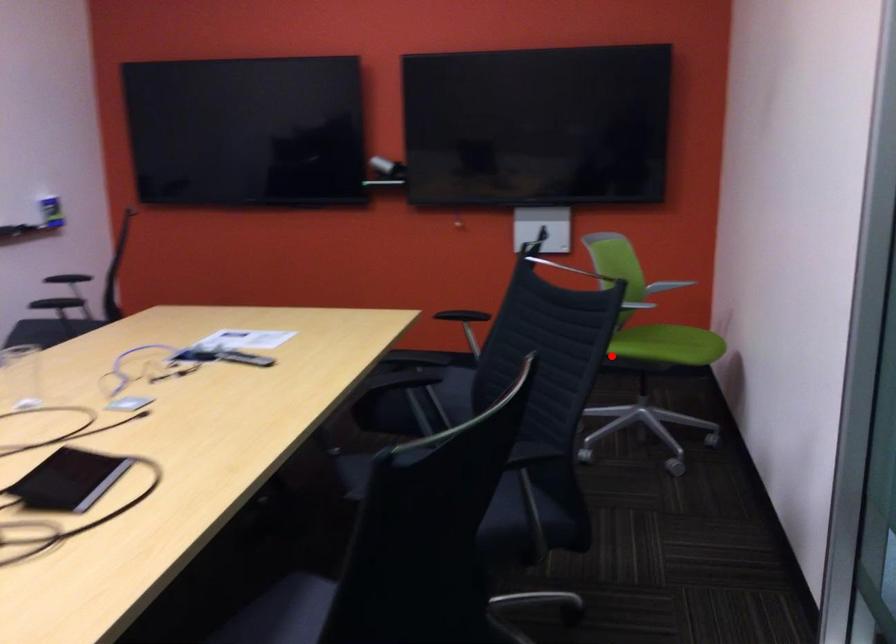
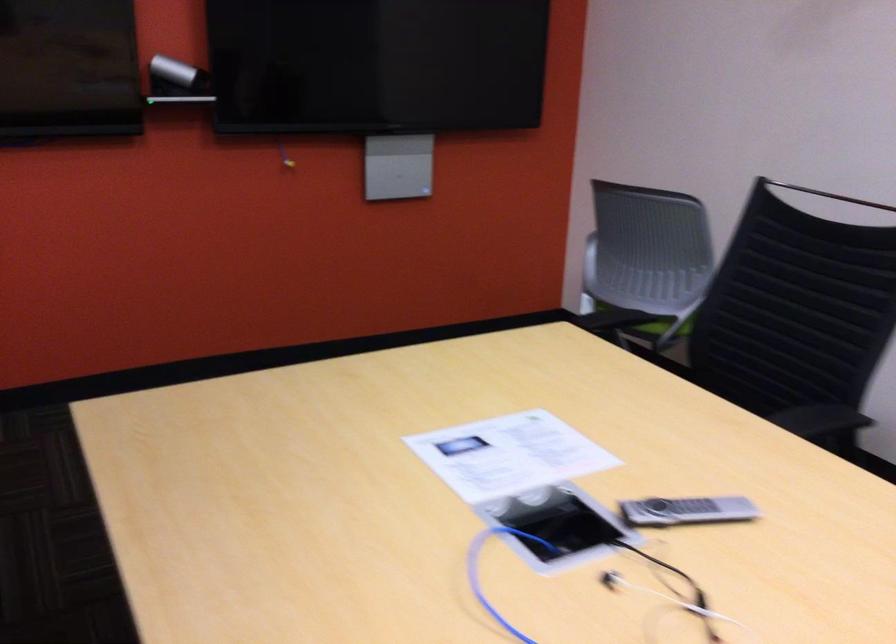
Find the pixel in the second image that matches the highlighted location in the first image.

(653, 325)